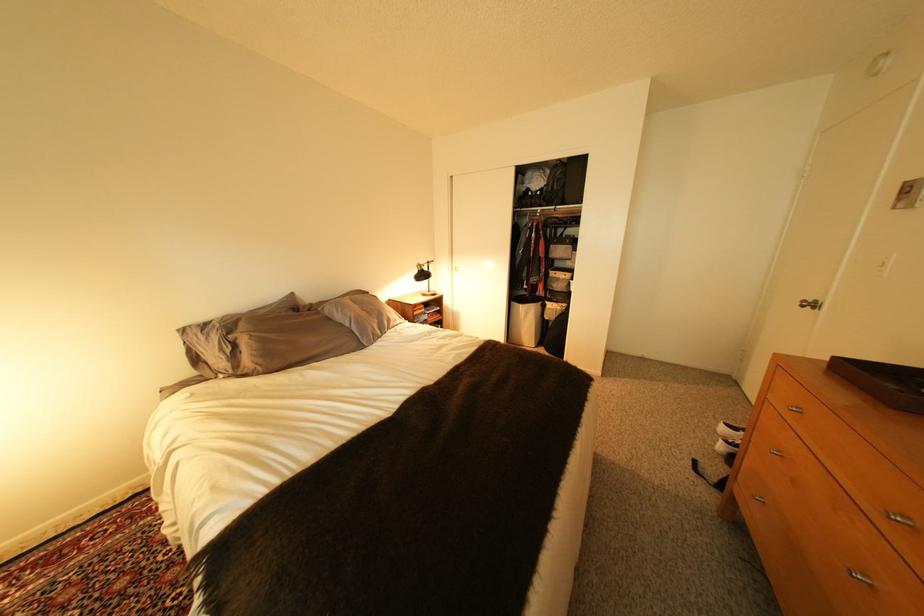
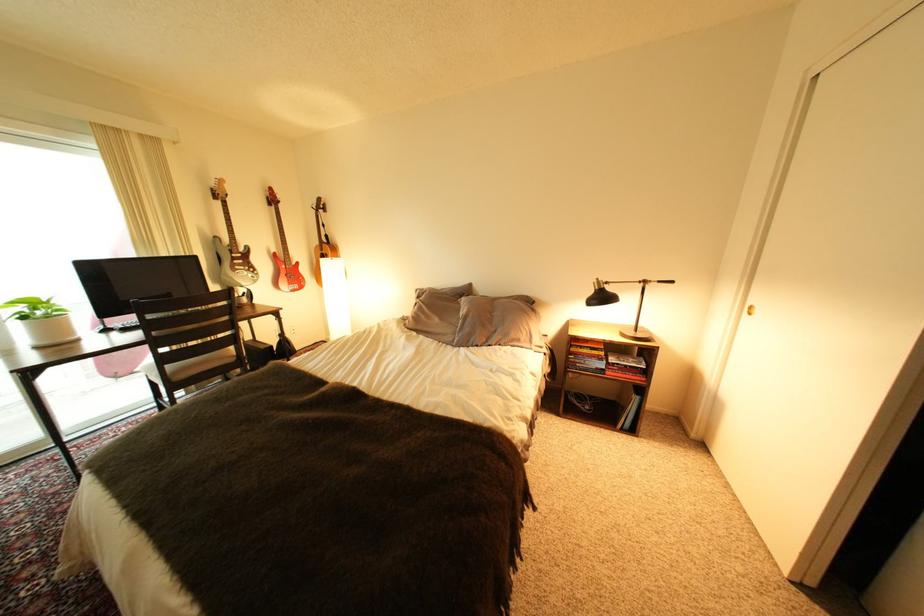
Where in the second image is the point corresponding to point 434,280 from the first image?

(608, 304)